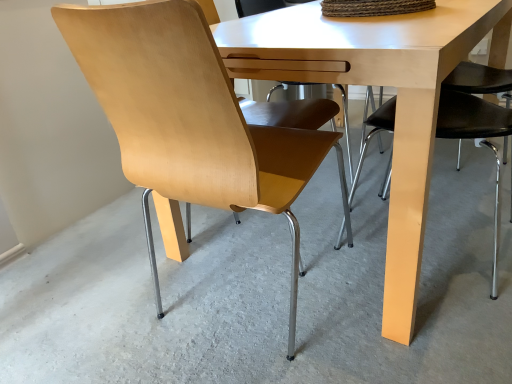
Question: From a real-world perspective, relative to light brown wood chair at left, is light wood table at center vertically above or below?

Choices:
 (A) below
 (B) above

Answer: (A)

Question: Is light wood table at center in front of or behind light brown wood chair at left in the image?

Choices:
 (A) front
 (B) behind

Answer: (B)

Question: Looking at the image, does light wood table at center seem bigger or smaller compared to light brown wood chair at left?

Choices:
 (A) small
 (B) big

Answer: (B)

Question: Relative to light wood table at center, is light brown wood chair at left in front or behind?

Choices:
 (A) behind
 (B) front

Answer: (B)

Question: In terms of size, does light brown wood chair at left appear bigger or smaller than light wood table at center?

Choices:
 (A) big
 (B) small

Answer: (B)

Question: From the image's perspective, is light brown wood chair at left above or below light wood table at center?

Choices:
 (A) above
 (B) below

Answer: (B)

Question: In the image, is light brown wood chair at left on the left side or the right side of light wood table at center?

Choices:
 (A) left
 (B) right

Answer: (A)